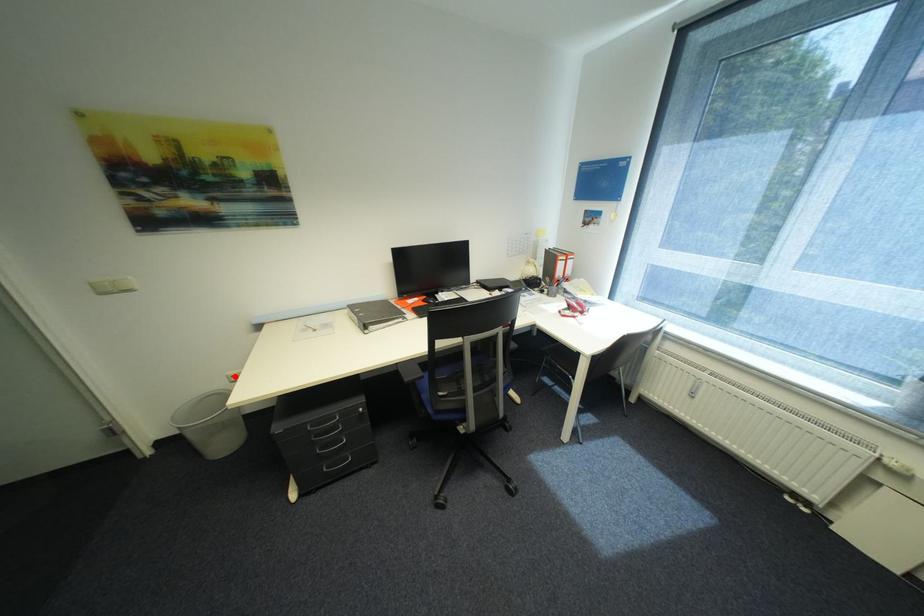
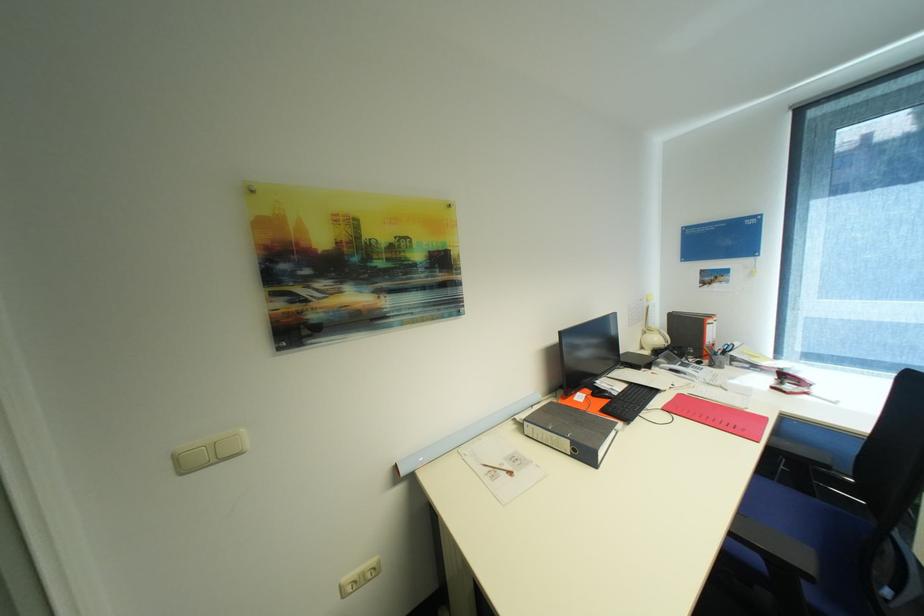
Where in the second image is the point corresponding to the highlighted location from the first image?

(348, 586)